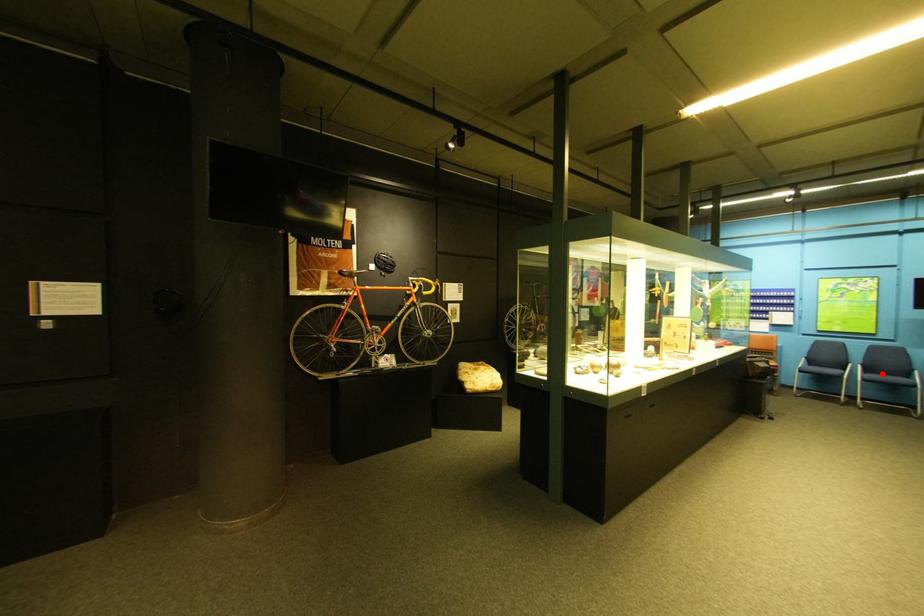
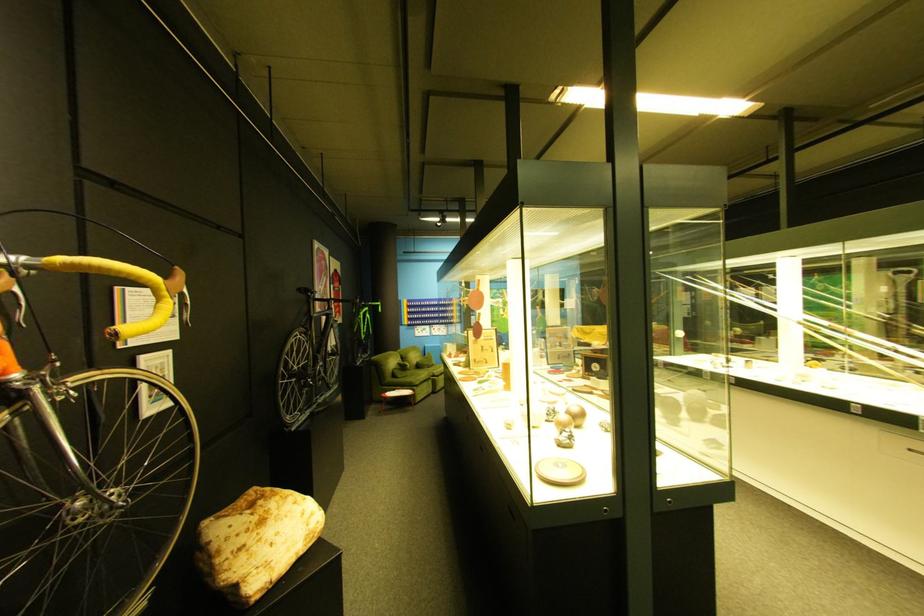
Question: I am providing you with two images of the same scene from different viewpoints. A red point is marked on the first image. Can you still see the location of the red point in image 2?

Choices:
 (A) Yes
 (B) No

Answer: (B)